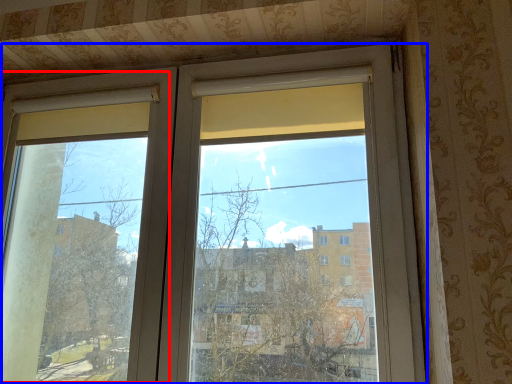
Question: Which object is closer to the camera taking this photo, screen door (highlighted by a red box) or window (highlighted by a blue box)?

Choices:
 (A) screen door
 (B) window

Answer: (B)